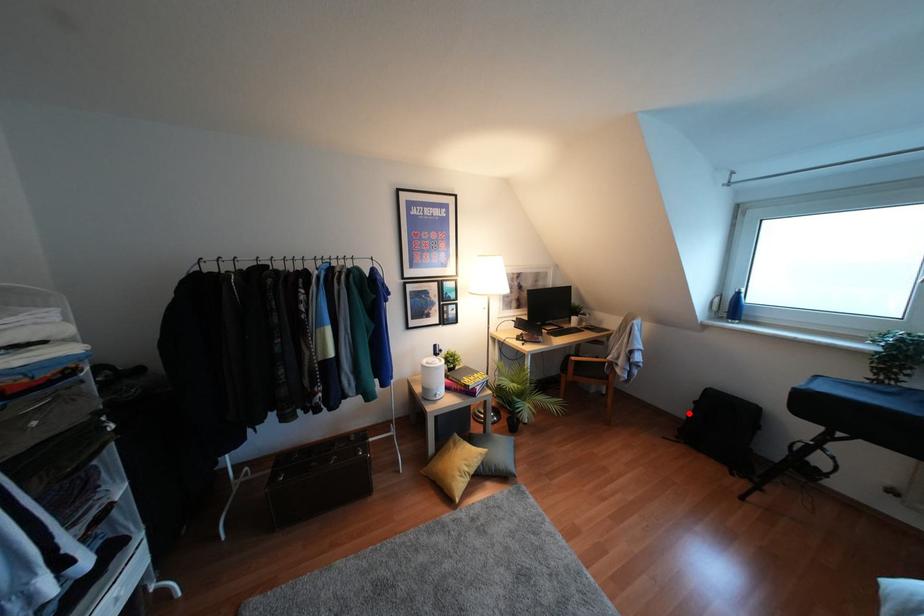
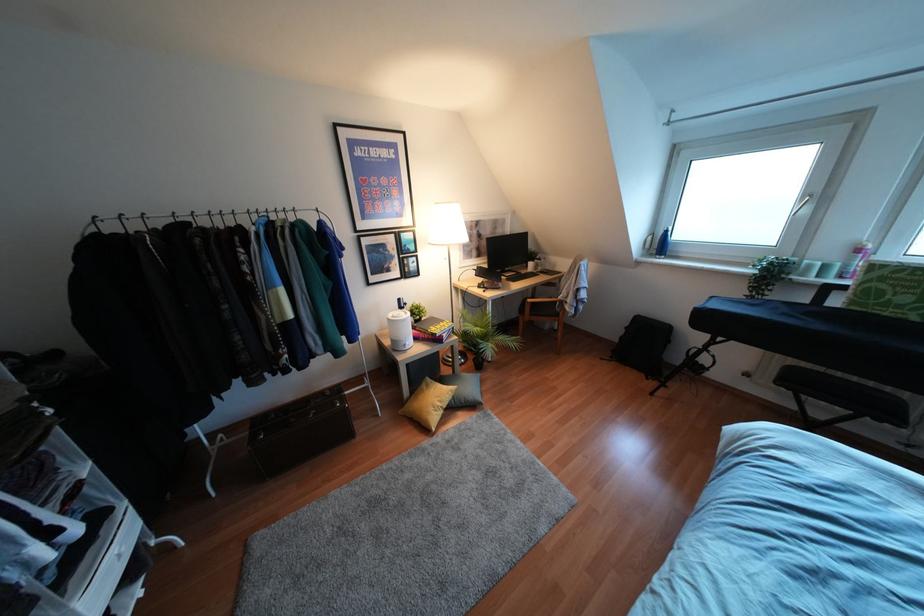
Find the pixel in the second image that matches the highlighted location in the first image.

(621, 337)